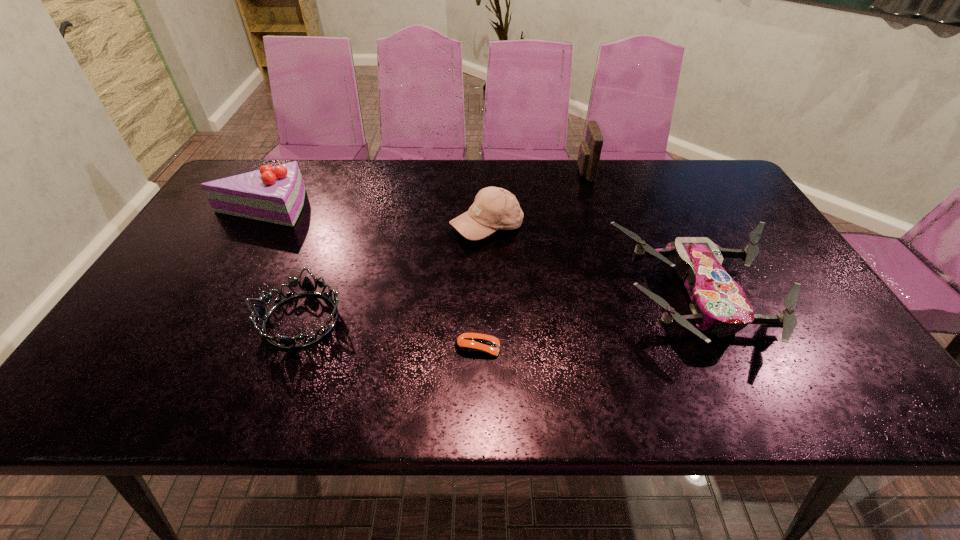
Locate an element on the screen. The image size is (960, 540). the farthest object is located at coordinates (589, 154).

You are a GUI agent. You are given a task and a screenshot of the screen. Output one action in this format:
    pyautogui.click(x=<x>, y=<y>)
    Task: Click on the leftmost object
    
    Given the screenshot: What is the action you would take?
    pyautogui.click(x=276, y=194)

Find the location of `the fourth shortest object`. the fourth shortest object is located at coordinates click(x=494, y=208).

Locate an element on the screen. drone is located at coordinates (719, 306).

Image resolution: width=960 pixels, height=540 pixels. I want to click on the second shortest object, so click(x=307, y=287).

Find the location of a particular element. tiara is located at coordinates (307, 287).

Find the location of a particular element. the shortest object is located at coordinates (472, 344).

Locate an element on the screen. free spot located 0.390m with an open flap on the pouch is located at coordinates (460, 173).

The width and height of the screenshot is (960, 540). In order to click on free point located with an open flap on the pouch in this screenshot , I will do `click(490, 173)`.

The width and height of the screenshot is (960, 540). Find the location of `vacant space located 0.390m with an open flap on the pouch`. vacant space located 0.390m with an open flap on the pouch is located at coordinates (460, 173).